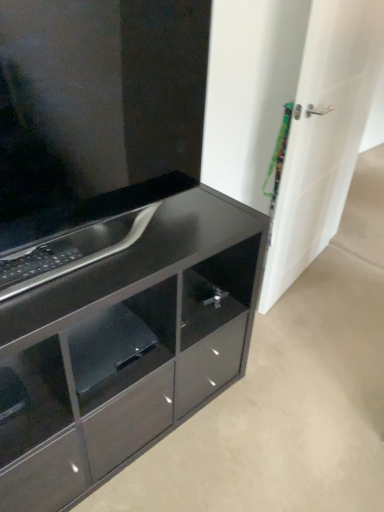
Question: From the image's perspective, relative to glossy black shelf at lower center, is glossy black cabinet at center above or below?

Choices:
 (A) below
 (B) above

Answer: (B)

Question: Based on their positions, is glossy black cabinet at center located to the left or right of glossy black shelf at lower center?

Choices:
 (A) right
 (B) left

Answer: (A)

Question: Estimate the real-world distances between objects in this image. Which object is closer to the glossy black cabinet at lower left?

Choices:
 (A) glossy black shelf at lower center
 (B) white glossy door at right
 (C) glossy black cabinet at center

Answer: (A)

Question: Which of these objects is positioned closest to the glossy black cabinet at lower left?

Choices:
 (A) glossy black cabinet at center
 (B) glossy black shelf at lower center
 (C) white glossy door at right

Answer: (B)